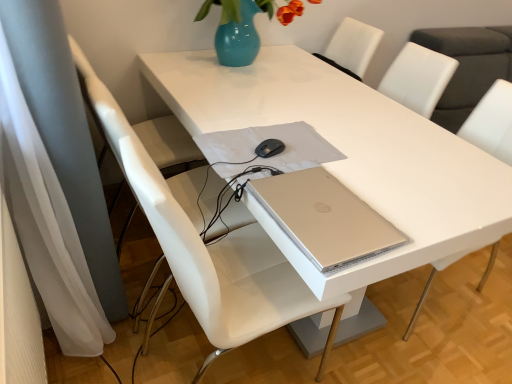
Question: Is white leather chair at center, placed as the 2th chair when sorted from left to right, situated inside white glossy table at center or outside?

Choices:
 (A) outside
 (B) inside

Answer: (B)

Question: Considering the positions of point (476, 107) and point (267, 74), is point (476, 107) closer or farther from the camera than point (267, 74)?

Choices:
 (A) farther
 (B) closer

Answer: (A)

Question: Which object is positioned closest to the white plastic swivel chair at left?

Choices:
 (A) matte blue vase at upper center
 (B) silver metallic laptop at center
 (C) white leather chair at center, which appears as the 1th chair when viewed from the right
 (D) white glossy table at center
 (E) white leather chair at center, the first chair viewed from the left

Answer: (E)

Question: Based on their relative distances, which object is farther from the white leather chair at center, which appears as the 1th chair when viewed from the right?

Choices:
 (A) matte blue vase at upper center
 (B) white plastic swivel chair at left
 (C) silver metallic laptop at center
 (D) white glossy table at center
 (E) white leather chair at center, marked as the second chair in a right-to-left arrangement

Answer: (B)